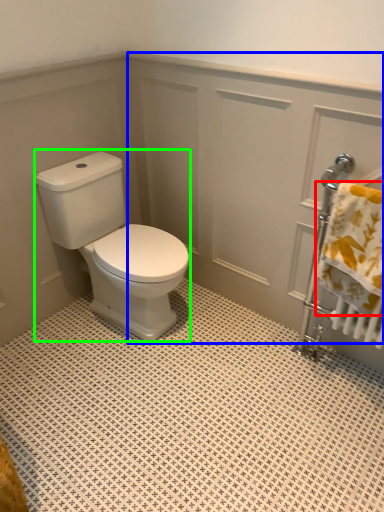
Question: Which object is positioned farthest from bath towel (highlighted by a red box)? Select from screen door (highlighted by a blue box) and porcelain (highlighted by a green box).

Choices:
 (A) screen door
 (B) porcelain

Answer: (B)